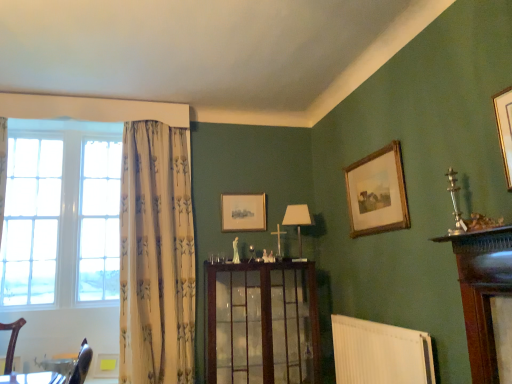
Question: From the image's perspective, does white ribbed radiator at lower center appear lower than white fabric lampshade at center?

Choices:
 (A) no
 (B) yes

Answer: (B)

Question: Does white ribbed radiator at lower center have a greater width compared to white fabric lampshade at center?

Choices:
 (A) yes
 (B) no

Answer: (B)

Question: Does white ribbed radiator at lower center lie behind white fabric lampshade at center?

Choices:
 (A) yes
 (B) no

Answer: (B)

Question: Can you confirm if white ribbed radiator at lower center is shorter than white fabric lampshade at center?

Choices:
 (A) yes
 (B) no

Answer: (B)

Question: Can you confirm if white ribbed radiator at lower center is positioned to the right of white fabric lampshade at center?

Choices:
 (A) no
 (B) yes

Answer: (B)

Question: Can we say white ribbed radiator at lower center lies outside white fabric lampshade at center?

Choices:
 (A) no
 (B) yes

Answer: (B)

Question: Considering the relative sizes of wooden picture frame at upper right, the 2th picture frame from the back, and white fabric lampshade at center in the image provided, is wooden picture frame at upper right, the 2th picture frame from the back, thinner than white fabric lampshade at center?

Choices:
 (A) no
 (B) yes

Answer: (B)

Question: Does wooden picture frame at upper right, the 2th picture frame from the back, come in front of white fabric lampshade at center?

Choices:
 (A) no
 (B) yes

Answer: (B)

Question: Is wooden picture frame at upper right, which is counted as the 1th picture frame, starting from the front, surrounding white fabric lampshade at center?

Choices:
 (A) no
 (B) yes

Answer: (A)

Question: Does wooden picture frame at upper right, which is counted as the 1th picture frame, starting from the front, have a greater width compared to white fabric lampshade at center?

Choices:
 (A) yes
 (B) no

Answer: (B)

Question: Is wooden picture frame at upper right, which is counted as the 1th picture frame, starting from the front, next to white fabric lampshade at center and touching it?

Choices:
 (A) yes
 (B) no

Answer: (B)

Question: Is wooden picture frame at upper right, the 2th picture frame from the back, bigger than white fabric lampshade at center?

Choices:
 (A) yes
 (B) no

Answer: (A)

Question: From a real-world perspective, does white ribbed radiator at lower center stand above matte wooden picture frame at center, which is counted as the second picture frame, starting from the right?

Choices:
 (A) no
 (B) yes

Answer: (A)